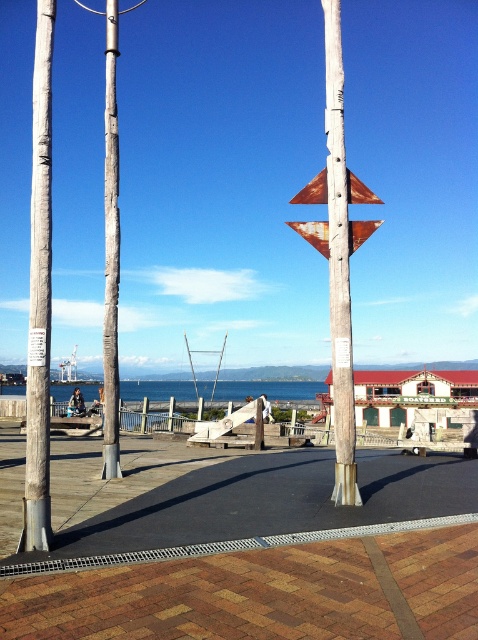
Question: Which object appears farthest from the camera in this image?

Choices:
 (A) blue water at center
 (B) weathered wood pole at left

Answer: (A)

Question: Can you confirm if black asphalt pavement at lower center is positioned to the right of blue water at center?

Choices:
 (A) yes
 (B) no

Answer: (A)

Question: Among these objects, which one is farthest from the camera?

Choices:
 (A) blue water at center
 (B) rusty metal sign at center

Answer: (A)

Question: Which point is farther from the camera taking this photo?

Choices:
 (A) (348, 234)
 (B) (264, 536)
 (C) (346, 426)

Answer: (A)

Question: From the image, what is the correct spatial relationship of weathered wood pole at left in relation to rusty metal sign at center?

Choices:
 (A) above
 (B) below

Answer: (A)

Question: Does black asphalt pavement at lower center appear on the right side of weathered wood pole at left?

Choices:
 (A) yes
 (B) no

Answer: (A)